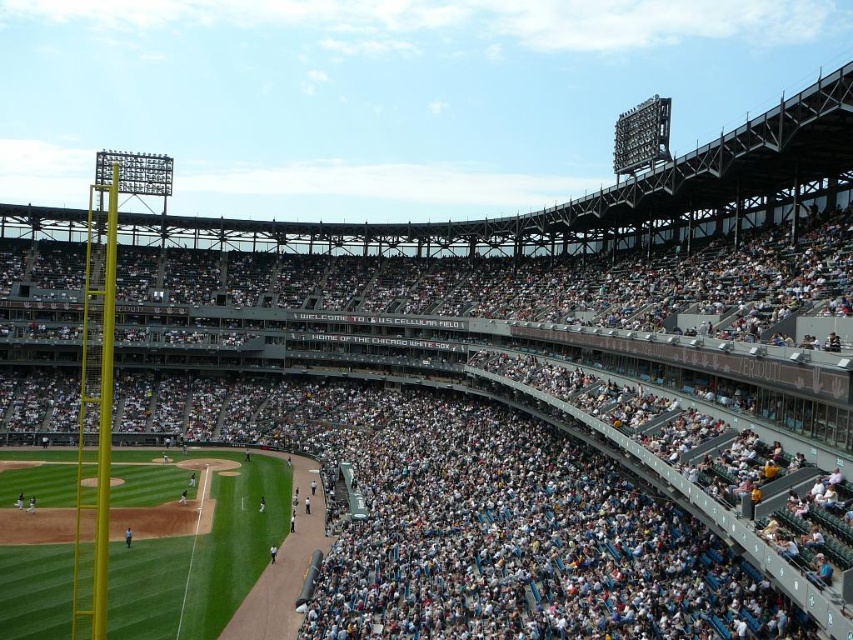
You are a photographer at U.S. Cellular Field and want to capture a wide shot of the metallic silver baseball team at center and the light brown leather glove at lower left. Which object will appear wider in the photo?

The metallic silver baseball team at center will appear wider in the photo because its width surpasses that of the light brown leather glove at lower left.